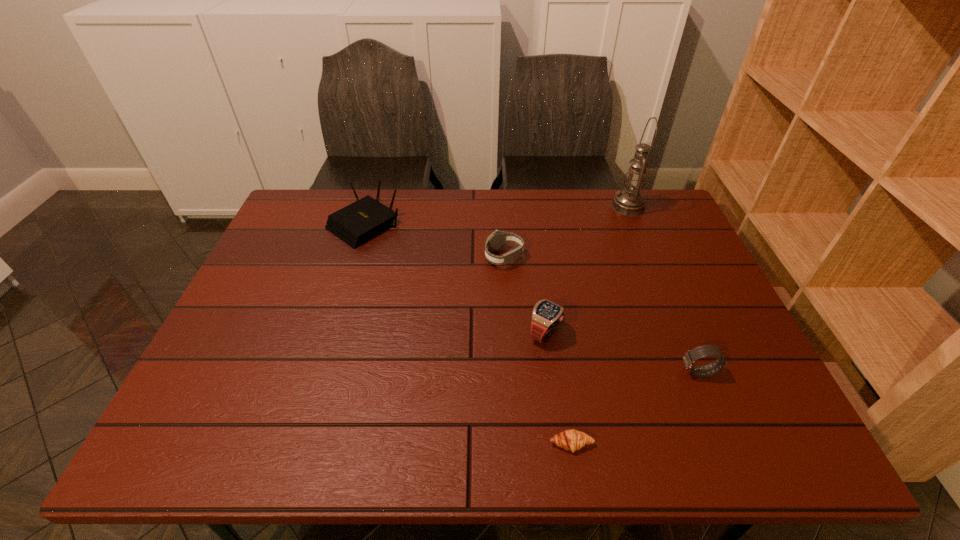
Find the location of a particular element. The height and width of the screenshot is (540, 960). object situated at the left edge is located at coordinates (361, 221).

The width and height of the screenshot is (960, 540). I want to click on oil lamp positioned at the right edge, so click(x=629, y=202).

Where is `watch that is at the right edge`? The height and width of the screenshot is (540, 960). watch that is at the right edge is located at coordinates (689, 358).

This screenshot has height=540, width=960. I want to click on object positioned at the far left corner, so click(x=361, y=221).

The image size is (960, 540). I want to click on object that is at the far right corner, so click(x=629, y=202).

Where is `vacant space at the far edge`? This screenshot has width=960, height=540. vacant space at the far edge is located at coordinates (462, 225).

At what (x,y) coordinates should I click in order to perform the action: click on vacant space at the near edge. Please return your answer as a coordinate pair (x, y). This screenshot has width=960, height=540. Looking at the image, I should click on (330, 455).

Locate an element on the screen. The width and height of the screenshot is (960, 540). blank space at the left edge of the desktop is located at coordinates (308, 273).

The height and width of the screenshot is (540, 960). In the image, there is a desktop. Find the location of `vacant space at the right edge`. vacant space at the right edge is located at coordinates (733, 332).

Locate an element on the screen. vacant space at the far left corner of the desktop is located at coordinates (290, 220).